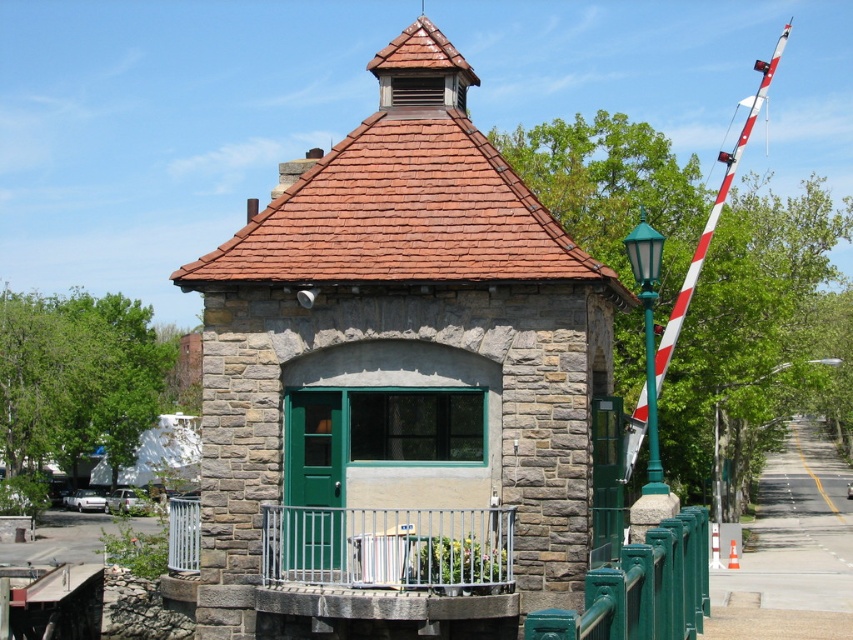
You are standing at the entrance of the stone structure and want to walk towards the point labeled as point [527,410]. Which direction should you move relative to the other point labeled point [706,230]?

You should move towards the point [527,410], which is in front of point [706,230]. Since point [527,410] is in front, you should move forward in the direction facing away from point [706,230].

You are standing at the entrance of the stone structure and want to walk directly towards the stone gazebo at center. In which direction should you move?

Since the stone gazebo at center is located at point (x=398, y=365), you should move towards the center of the image to reach it.